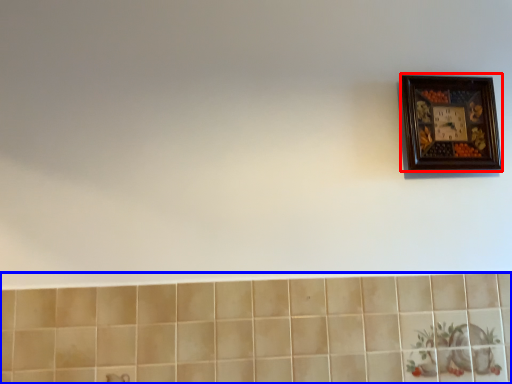
Question: Among these objects, which one is farthest to the camera, picture frame (highlighted by a red box) or ceramic tile (highlighted by a blue box)?

Choices:
 (A) picture frame
 (B) ceramic tile

Answer: (A)